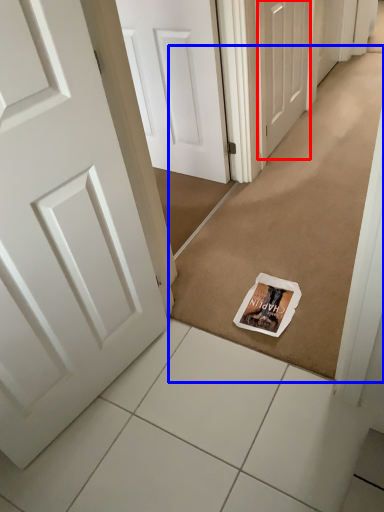
Question: Which of the following is the closest to the observer, door (highlighted by a red box) or doormat (highlighted by a blue box)?

Choices:
 (A) door
 (B) doormat

Answer: (B)